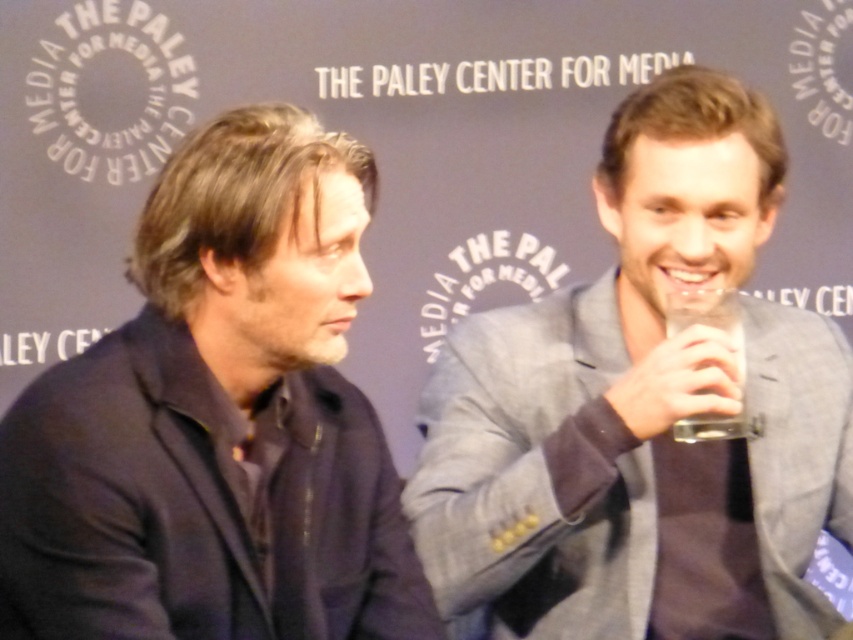
Does gray fabric suit at right have a smaller size compared to dark blue fabric at left?

No.

Is point (538, 472) closer to camera compared to point (271, 444)?

No, (538, 472) is behind (271, 444).

The width and height of the screenshot is (853, 640). Identify the location of gray fabric suit at right. (641, 412).

Is point (265, 624) farther from viewer compared to point (695, 307)?

No, (265, 624) is in front of (695, 307).

Can you confirm if dark blue fabric at left is wider than clear glass cup at right?

Yes.

Which is in front, point (238, 179) or point (699, 320)?

Point (238, 179) is in front.

Find the location of a particular element. This screenshot has width=853, height=640. dark blue fabric at left is located at coordinates (218, 419).

Does gray fabric suit at right have a lesser width compared to clear glass cup at right?

In fact, gray fabric suit at right might be wider than clear glass cup at right.

Between gray fabric suit at right and clear glass cup at right, which one is positioned lower?

gray fabric suit at right

Measure the distance between gray fabric suit at right and camera.

The distance of gray fabric suit at right from camera is 1.47 meters.

Locate an element on the screen. The image size is (853, 640). gray fabric suit at right is located at coordinates click(641, 412).